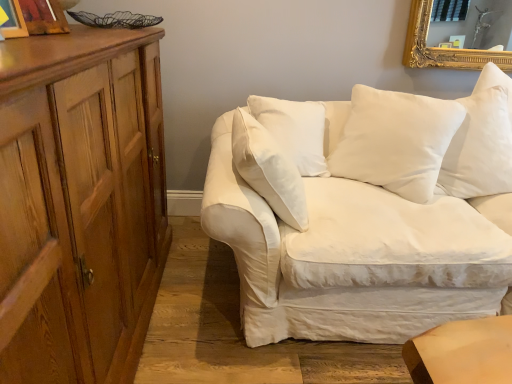
Question: Is point (7, 13) positioned closer to the camera than point (506, 142)?

Choices:
 (A) farther
 (B) closer

Answer: (B)

Question: Considering the positions of wooden picture frame at upper left, acting as the second picture frame starting from the back, and white soft pillow at upper right, arranged as the first pillow when viewed from the right, in the image, is wooden picture frame at upper left, acting as the second picture frame starting from the back, taller or shorter than white soft pillow at upper right, arranged as the first pillow when viewed from the right,?

Choices:
 (A) short
 (B) tall

Answer: (A)

Question: Which object is the farthest from the white cotton pillow at center, the 2th pillow from the right?

Choices:
 (A) wooden picture frame at upper left, the 1th picture frame in the front-to-back sequence
 (B) wooden picture frame at upper left, the 1th picture frame when ordered from back to front
 (C) white cotton couch at center
 (D) wooden cabinet at left
 (E) white soft pillow at upper right, the 2th pillow in the left-to-right sequence

Answer: (A)

Question: Which of these objects is positioned farthest from the white soft pillow at upper right, the 2th pillow in the left-to-right sequence?

Choices:
 (A) wooden picture frame at upper left, which is the second picture frame from front to back
 (B) white cotton couch at center
 (C) wooden picture frame at upper left, the 1th picture frame in the front-to-back sequence
 (D) white cotton pillow at center, the 2th pillow from the right
 (E) wooden cabinet at left

Answer: (C)